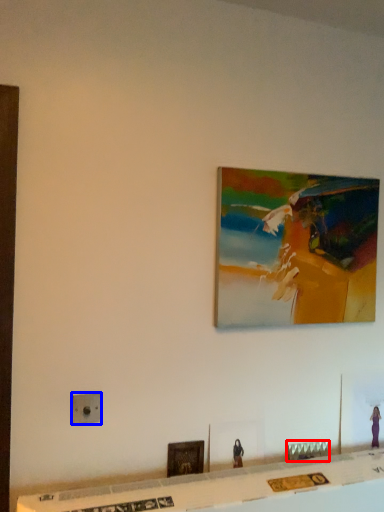
Question: Which object is further to the camera taking this photo, furniture (highlighted by a red box) or electric outlet (highlighted by a blue box)?

Choices:
 (A) furniture
 (B) electric outlet

Answer: (A)